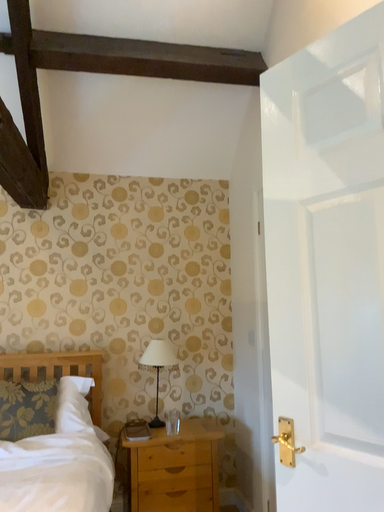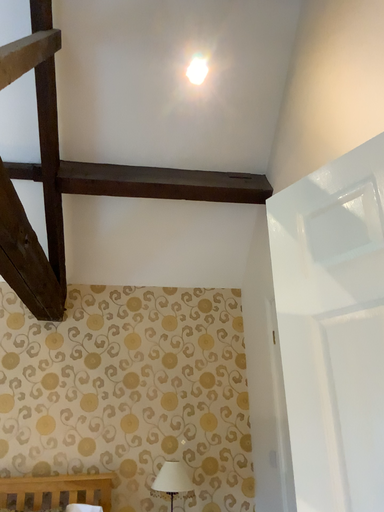
Question: Which way did the camera rotate in the video?

Choices:
 (A) rotated downward
 (B) rotated upward

Answer: (B)